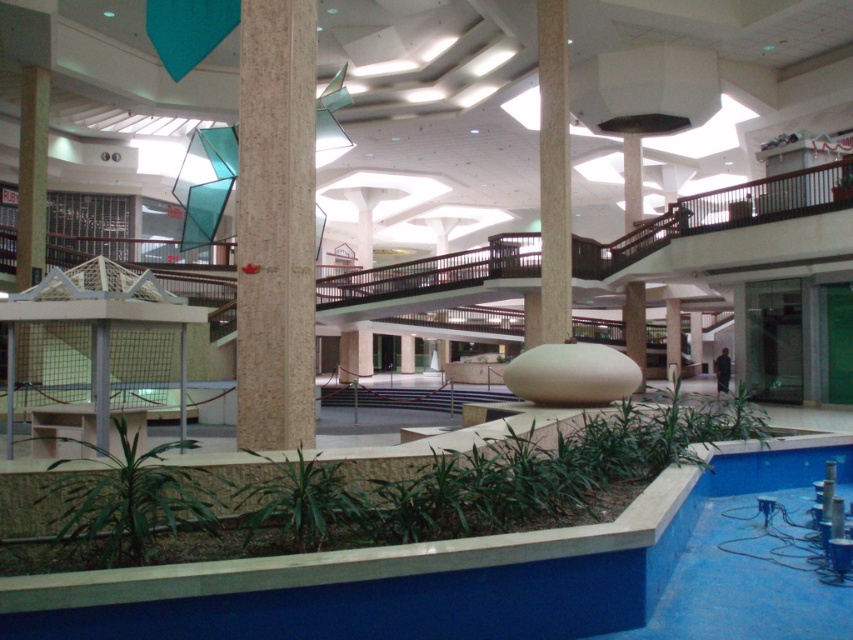
You are standing in the shopping mall atrium and see the beige marble pillar at center and the green leafy plant at lower center. Which object is positioned higher from the ground?

The beige marble pillar at center is positioned higher from the ground than the green leafy plant at lower center because it is described as being above it.

You are a maintenance worker needing to place a new decorative statue that requires a 2 square meter space. Based on the scene, which object between the blue smooth pool at lower center and the green leafy plant at lower center would be more suitable for placing the statue?

The blue smooth pool at lower center is larger in size than the green leafy plant at lower center, so the blue smooth pool at lower center would be more suitable for placing the statue as it has enough space.

You are standing at the entrance of the shopping mall and want to take a photo of the point at coordinates point (74, 529). Your camera has a maximum focus range of 4 meters. Will you be able to focus on the point?

The distance of point (74, 529) from camera is 3.97 meters, which is within the camera maximum focus range of 4 meters. So yes, you can focus on the point.